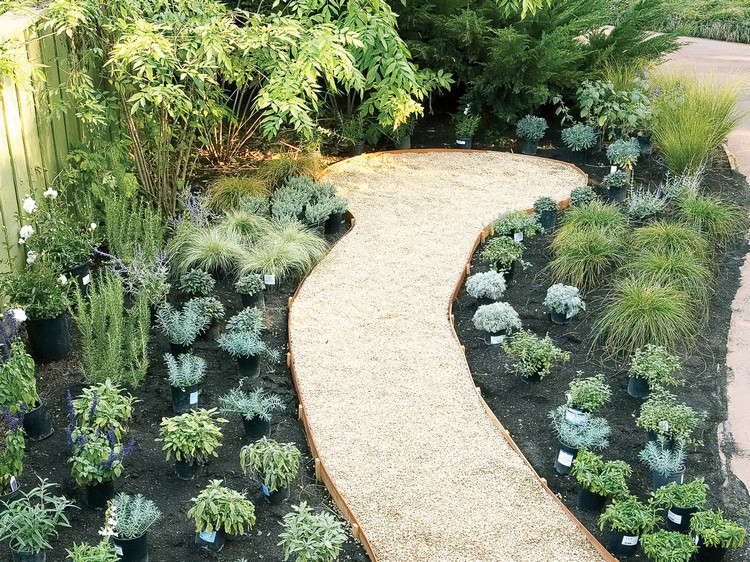
The image size is (750, 562). In order to click on light in this screenshot , I will do `click(562, 466)`.